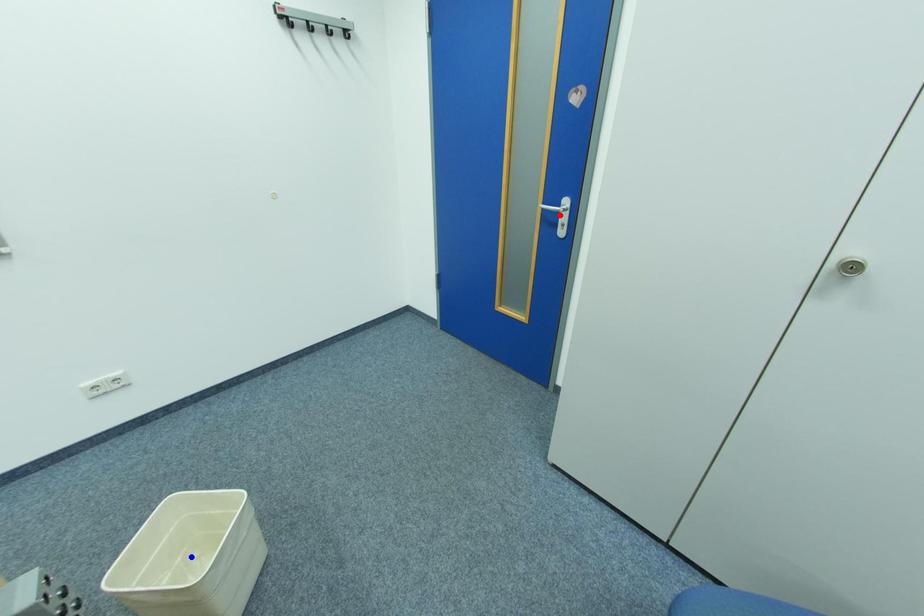
Question: In the image, two points are highlighted. Which point is nearer to the camera? Reply with the corresponding letter.

Choices:
 (A) blue point
 (B) red point

Answer: (A)